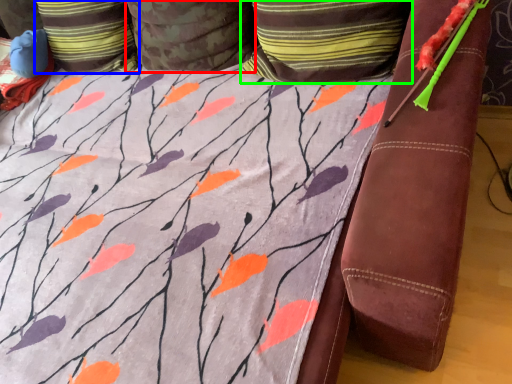
Question: Which object is the closest to the pillow (highlighted by a red box)? Choose among these: pillow (highlighted by a blue box) or pillow (highlighted by a green box).

Choices:
 (A) pillow
 (B) pillow

Answer: (A)